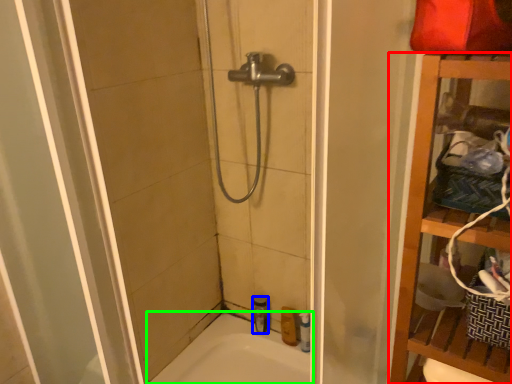
Question: Which object is positioned farthest from furniture (highlighted by a red box)? Select from toiletry (highlighted by a blue box) and bathtub (highlighted by a green box).

Choices:
 (A) toiletry
 (B) bathtub

Answer: (A)